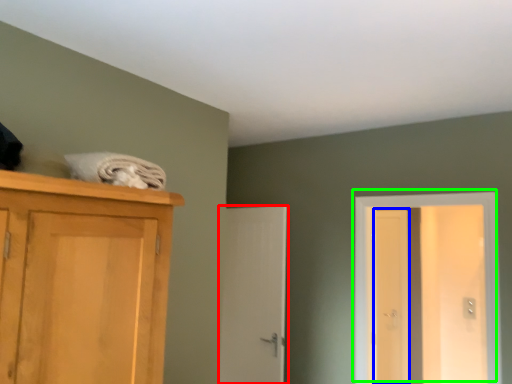
Question: Considering the real-world distances, which object is closest to door (highlighted by a red box)? screen door (highlighted by a blue box) or door (highlighted by a green box).

Choices:
 (A) screen door
 (B) door

Answer: (B)